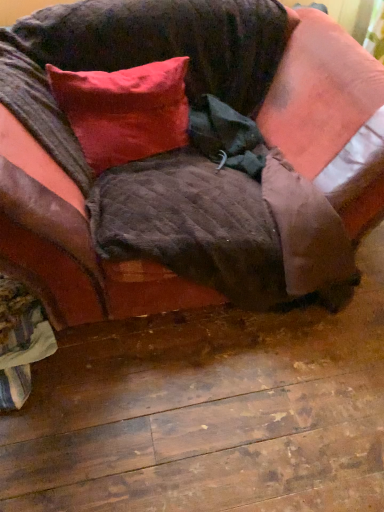
Question: Considering the positions of satin red pillow at upper left and velvet brown couch at center in the image, is satin red pillow at upper left bigger or smaller than velvet brown couch at center?

Choices:
 (A) small
 (B) big

Answer: (A)

Question: Does point click(134, 103) appear closer or farther from the camera than point click(8, 112)?

Choices:
 (A) farther
 (B) closer

Answer: (A)

Question: From the image's perspective, is satin red pillow at upper left above or below velvet brown couch at center?

Choices:
 (A) below
 (B) above

Answer: (B)

Question: In terms of height, does velvet brown couch at center look taller or shorter compared to satin red pillow at upper left?

Choices:
 (A) tall
 (B) short

Answer: (A)

Question: Is velvet brown couch at center wider or thinner than satin red pillow at upper left?

Choices:
 (A) thin
 (B) wide

Answer: (B)

Question: From the image's perspective, is velvet brown couch at center located above or below satin red pillow at upper left?

Choices:
 (A) below
 (B) above

Answer: (A)

Question: Looking at the image, does velvet brown couch at center seem bigger or smaller compared to satin red pillow at upper left?

Choices:
 (A) big
 (B) small

Answer: (A)